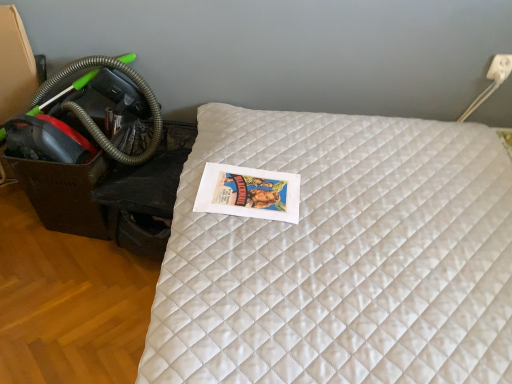
Question: Considering the relative sizes of white quilted mattress at center and green rubber garden hose at left in the image provided, is white quilted mattress at center bigger than green rubber garden hose at left?

Choices:
 (A) no
 (B) yes

Answer: (B)

Question: Is white quilted mattress at center further to camera compared to green rubber garden hose at left?

Choices:
 (A) yes
 (B) no

Answer: (B)

Question: Can you confirm if white quilted mattress at center is taller than green rubber garden hose at left?

Choices:
 (A) yes
 (B) no

Answer: (A)

Question: Does white quilted mattress at center lie in front of green rubber garden hose at left?

Choices:
 (A) yes
 (B) no

Answer: (A)

Question: Considering the relative sizes of white quilted mattress at center and green rubber garden hose at left in the image provided, is white quilted mattress at center smaller than green rubber garden hose at left?

Choices:
 (A) no
 (B) yes

Answer: (A)

Question: Considering their positions, is green rubber garden hose at left located in front of or behind white plastic electric outlet at upper right?

Choices:
 (A) front
 (B) behind

Answer: (A)

Question: In terms of size, does green rubber garden hose at left appear bigger or smaller than white plastic electric outlet at upper right?

Choices:
 (A) small
 (B) big

Answer: (B)

Question: Does point (112, 59) appear closer or farther from the camera than point (506, 64)?

Choices:
 (A) farther
 (B) closer

Answer: (A)

Question: Visually, is green rubber garden hose at left positioned to the left or to the right of white plastic electric outlet at upper right?

Choices:
 (A) right
 (B) left

Answer: (B)

Question: From a real-world perspective, is white quilted mattress at center positioned above or below green rubber garden hose at left?

Choices:
 (A) below
 (B) above

Answer: (A)

Question: In terms of width, does white quilted mattress at center look wider or thinner when compared to green rubber garden hose at left?

Choices:
 (A) thin
 (B) wide

Answer: (B)

Question: Would you say white quilted mattress at center is to the left or to the right of green rubber garden hose at left in the picture?

Choices:
 (A) left
 (B) right

Answer: (B)

Question: Is white quilted mattress at center in front of or behind green rubber garden hose at left in the image?

Choices:
 (A) front
 (B) behind

Answer: (A)

Question: In the image, is white quilted mattress at center positioned in front of or behind white plastic electric outlet at upper right?

Choices:
 (A) behind
 (B) front

Answer: (B)

Question: Visually, is white quilted mattress at center positioned to the left or to the right of white plastic electric outlet at upper right?

Choices:
 (A) right
 (B) left

Answer: (B)